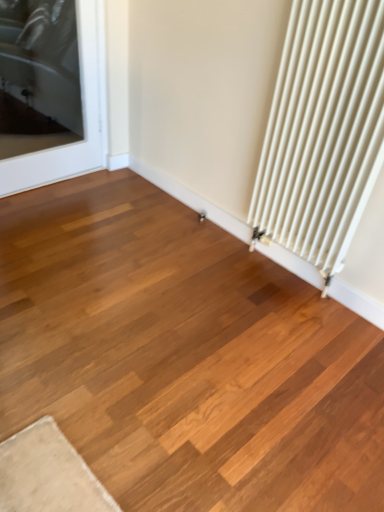
Question: In terms of height, does white matte radiator at right look taller or shorter compared to transparent glass door at upper left?

Choices:
 (A) short
 (B) tall

Answer: (B)

Question: From the image's perspective, is white matte radiator at right positioned above or below transparent glass door at upper left?

Choices:
 (A) above
 (B) below

Answer: (B)

Question: Is white matte radiator at right wider or thinner than transparent glass door at upper left?

Choices:
 (A) thin
 (B) wide

Answer: (B)

Question: In terms of height, does transparent glass door at upper left look taller or shorter compared to white matte radiator at right?

Choices:
 (A) tall
 (B) short

Answer: (B)

Question: Looking at their shapes, would you say transparent glass door at upper left is wider or thinner than white matte radiator at right?

Choices:
 (A) wide
 (B) thin

Answer: (B)

Question: Is point (23, 161) positioned closer to the camera than point (340, 236)?

Choices:
 (A) closer
 (B) farther

Answer: (B)

Question: From a real-world perspective, is transparent glass door at upper left positioned above or below white matte radiator at right?

Choices:
 (A) below
 (B) above

Answer: (A)